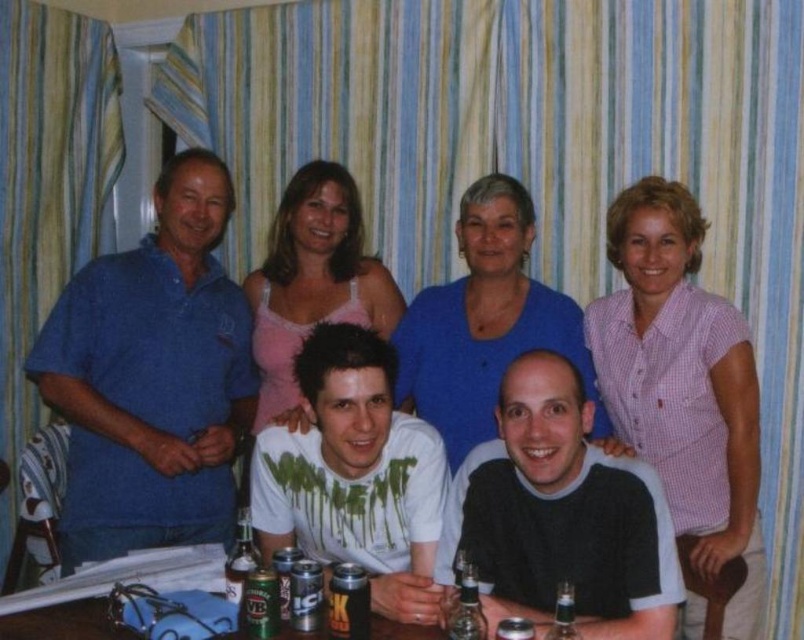
Which is more to the left, black matte can at center or translucent plastic bottle at lower center?

black matte can at center

Can you confirm if black matte can at center is shorter than translucent plastic bottle at lower center?

Yes, black matte can at center is shorter than translucent plastic bottle at lower center.

Is point (351, 608) less distant than point (470, 580)?

No, it is not.

The height and width of the screenshot is (640, 804). I want to click on black matte can at center, so click(x=347, y=602).

Between white matte shirt at center and translucent plastic bottle at lower center, which one appears on the right side from the viewer's perspective?

translucent plastic bottle at lower center is more to the right.

Between point (361, 515) and point (462, 588), which one is positioned behind?

The point (361, 515) is more distant.

Does point (394, 602) lie in front of point (470, 595)?

That is False.

Find the location of a particular element. The height and width of the screenshot is (640, 804). white matte shirt at center is located at coordinates click(355, 474).

Who is positioned more to the left, pink satin tank top at center or black matte can at center?

pink satin tank top at center

Between pink satin tank top at center and black matte can at center, which one has less height?

With less height is black matte can at center.

Identify the location of pink satin tank top at center. (312, 282).